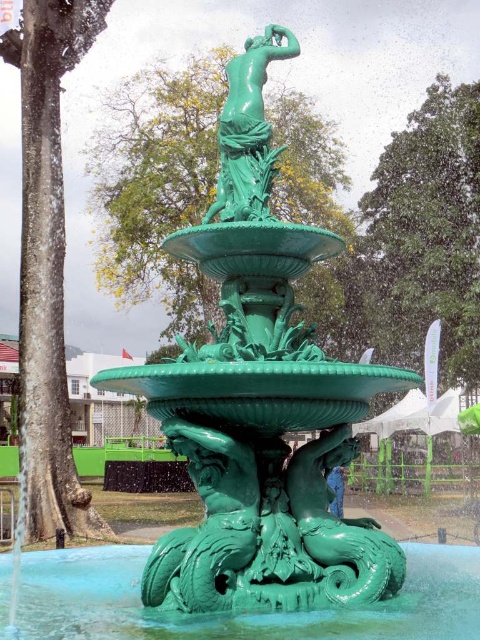
Which of these two, green polished fountain at center or green patinated bronze statue at upper center, stands shorter?

Standing shorter between the two is green patinated bronze statue at upper center.

Can you confirm if green polished fountain at center is shorter than green patinated bronze statue at upper center?

No.

Is point (254, 289) in front of point (252, 164)?

Yes, point (254, 289) is in front of point (252, 164).

Find the location of a particular element. green polished fountain at center is located at coordinates (260, 400).

What do you see at coordinates (260, 400) in the screenshot? I see `green polished fountain at center` at bounding box center [260, 400].

Between green polished fountain at center and green glossy water at center, which one appears on the right side from the viewer's perspective?

From the viewer's perspective, green glossy water at center appears more on the right side.

What do you see at coordinates (260, 400) in the screenshot? I see `green polished fountain at center` at bounding box center [260, 400].

The image size is (480, 640). In order to click on green polished fountain at center in this screenshot , I will do `click(260, 400)`.

I want to click on green glossy water at center, so click(x=239, y=612).

Can you confirm if green glossy water at center is smaller than green patinated bronze statue at upper center?

Incorrect, green glossy water at center is not smaller in size than green patinated bronze statue at upper center.

Does point (140, 572) come in front of point (271, 179)?

No, it is not.

Image resolution: width=480 pixels, height=640 pixels. Identify the location of green glossy water at center. (239, 612).